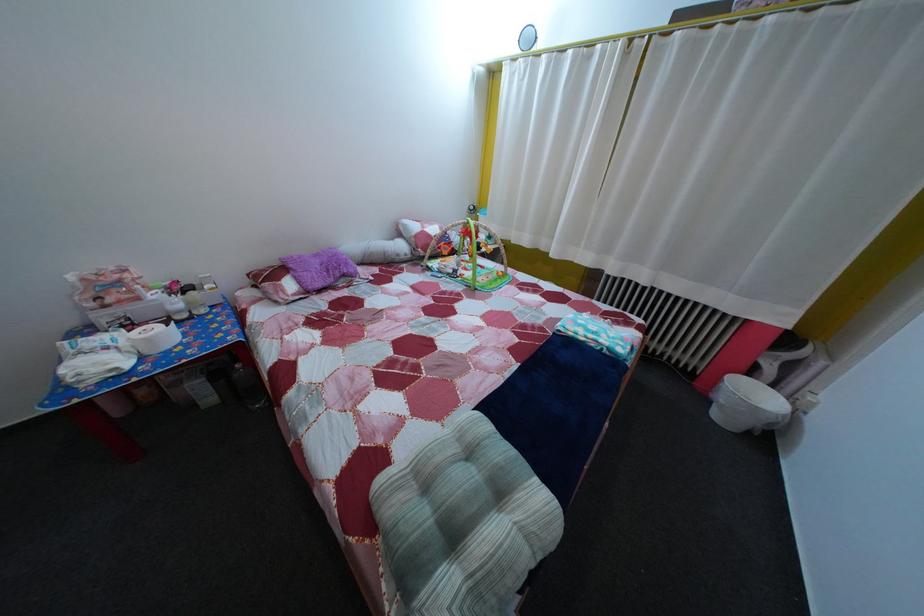
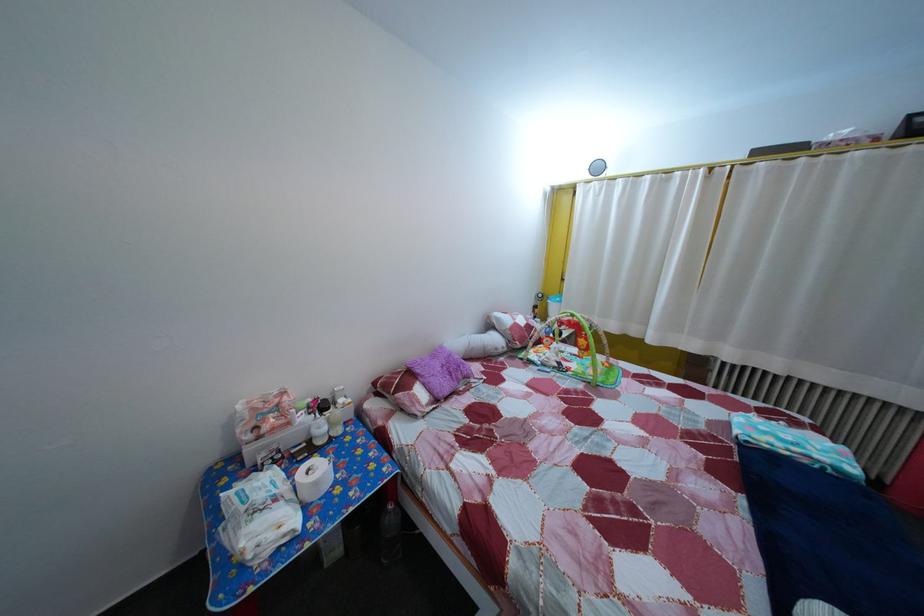
In the second image, find the point that corresponds to pixel 116 357 in the first image.

(285, 508)